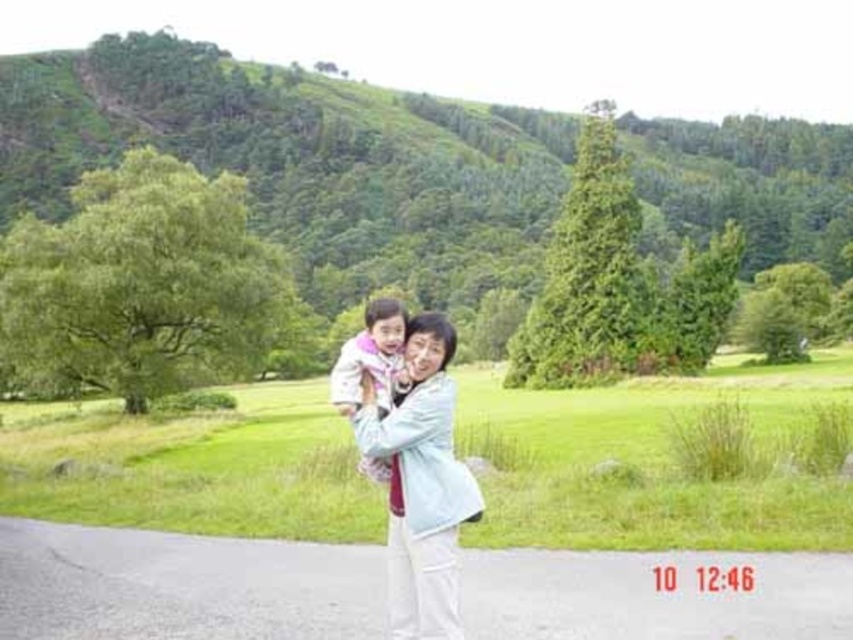
Which is behind, point (248, 513) or point (345, 387)?

The point (248, 513) is behind.

Which is behind, point (310, 534) or point (393, 298)?

The point (393, 298) is more distant.

I want to click on green grass at center, so click(x=654, y=460).

Consider the image. Who is more forward, (780, 474) or (451, 474)?

Point (451, 474) is in front.

Does point (126, 524) come in front of point (434, 576)?

No, (126, 524) is further to viewer.

Locate an element on the screen. This screenshot has height=640, width=853. green grass at center is located at coordinates (654, 460).

Based on the photo, does light blue fabric at center have a greater height compared to pink fabric at center?

No, light blue fabric at center is not taller than pink fabric at center.

Between light blue fabric at center and pink fabric at center, which one has more height?

pink fabric at center

The width and height of the screenshot is (853, 640). Describe the element at coordinates (421, 484) in the screenshot. I see `light blue fabric at center` at that location.

You are a GUI agent. You are given a task and a screenshot of the screen. Output one action in this format:
    pyautogui.click(x=<x>, y=<y>)
    Task: Click on the light blue fabric at center
    The height and width of the screenshot is (640, 853).
    Given the screenshot: What is the action you would take?
    pyautogui.click(x=421, y=484)